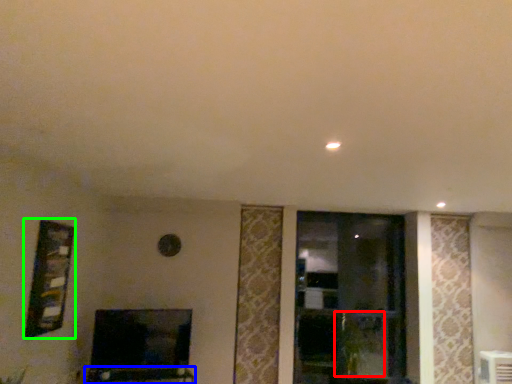
Question: Estimate the real-world distances between objects in this image. Which object is closer to plant (highlighted by a red box), furniture (highlighted by a blue box) or picture frame (highlighted by a green box)?

Choices:
 (A) furniture
 (B) picture frame

Answer: (A)